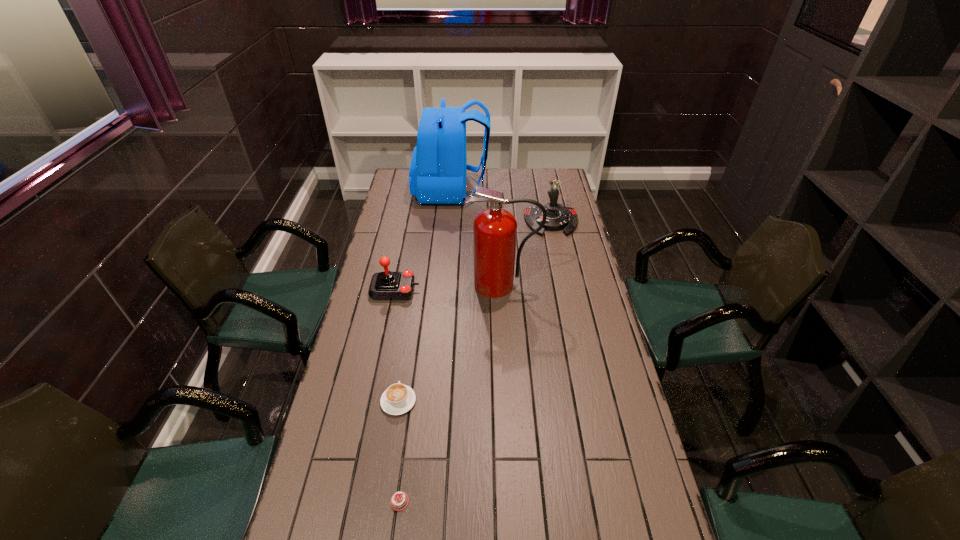
In order to click on joystick at the left edge in this screenshot , I will do `click(387, 285)`.

Identify the location of cappuccino situated at the left edge. The width and height of the screenshot is (960, 540). (397, 399).

Image resolution: width=960 pixels, height=540 pixels. Identify the location of object located in the right edge section of the desktop. click(x=559, y=217).

Where is `object that is at the far left corner`? The height and width of the screenshot is (540, 960). object that is at the far left corner is located at coordinates (437, 175).

The width and height of the screenshot is (960, 540). Find the location of `vacant space at the far edge`. vacant space at the far edge is located at coordinates (477, 183).

You are a GUI agent. You are given a task and a screenshot of the screen. Output one action in this format:
    pyautogui.click(x=<x>, y=<y>)
    Task: Click on the vacant region at the left edge of the desktop
    The height and width of the screenshot is (540, 960).
    Given the screenshot: What is the action you would take?
    pyautogui.click(x=364, y=340)

Find the location of a particular element. vacant point at the right edge is located at coordinates (606, 377).

The image size is (960, 540). In order to click on vacant region at the far right corner of the desktop in this screenshot , I will do `click(550, 175)`.

This screenshot has width=960, height=540. I want to click on unoccupied area between the fire extinguisher and the farther joystick, so click(527, 253).

This screenshot has width=960, height=540. Find the location of `vacant region between the fire extinguisher and the shortest object`. vacant region between the fire extinguisher and the shortest object is located at coordinates pos(451,393).